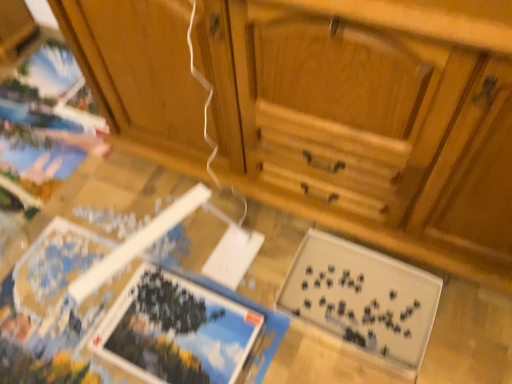
The image size is (512, 384). I want to click on wooden puzzle pieces at lower center, so click(77, 262).

You are a GUI agent. You are given a task and a screenshot of the screen. Output one action in this format:
    pyautogui.click(x=<x>, y=<y>)
    Task: Click on the black matte puzzle pieces at lower right, which is counted as the 1th magazine, starting from the right
    This screenshot has height=384, width=512.
    Given the screenshot: What is the action you would take?
    pyautogui.click(x=362, y=298)

Describe the element at coordinates (176, 331) in the screenshot. I see `blue glossy puzzle piece at lower left, the 1th magazine in the left-to-right sequence` at that location.

Find the location of a particular element. The height and width of the screenshot is (384, 512). blue glossy puzzle piece at lower left, the second magazine from the right is located at coordinates (176, 331).

Image resolution: width=512 pixels, height=384 pixels. In order to click on wooden puzzle pieces at lower center in this screenshot , I will do `click(77, 262)`.

Considering the relative sizes of blue glossy puzzle piece at lower left, the 1th magazine in the left-to-right sequence, and black matte puzzle pieces at lower right, which ranks as the second magazine in left-to-right order, in the image provided, is blue glossy puzzle piece at lower left, the 1th magazine in the left-to-right sequence, smaller than black matte puzzle pieces at lower right, which ranks as the second magazine in left-to-right order,?

Yes, blue glossy puzzle piece at lower left, the 1th magazine in the left-to-right sequence, is smaller than black matte puzzle pieces at lower right, which ranks as the second magazine in left-to-right order.

Considering the positions of point (238, 316) and point (393, 342), is point (238, 316) closer or farther from the camera than point (393, 342)?

Point (238, 316).

Which of these two, blue glossy puzzle piece at lower left, the second magazine from the right, or black matte puzzle pieces at lower right, which ranks as the second magazine in left-to-right order, stands shorter?

blue glossy puzzle piece at lower left, the second magazine from the right.

From the picture: Would you say wooden cabinet at center is part of black matte puzzle pieces at lower right, which ranks as the second magazine in left-to-right order,'s contents?

No.

Is black matte puzzle pieces at lower right, which is counted as the 1th magazine, starting from the right, at the right side of wooden cabinet at center?

Yes.

Between black matte puzzle pieces at lower right, which is counted as the 1th magazine, starting from the right, and wooden cabinet at center, which one has less height?

black matte puzzle pieces at lower right, which is counted as the 1th magazine, starting from the right.

Who is more distant, black matte puzzle pieces at lower right, which ranks as the second magazine in left-to-right order, or wooden cabinet at center?

black matte puzzle pieces at lower right, which ranks as the second magazine in left-to-right order, is further away from the camera.

Is wooden puzzle pieces at lower center in front of or behind black matte puzzle pieces at lower right, which ranks as the second magazine in left-to-right order, in the image?

wooden puzzle pieces at lower center is in front of black matte puzzle pieces at lower right, which ranks as the second magazine in left-to-right order.

Based on the photo, from a real-world perspective, relative to black matte puzzle pieces at lower right, which is counted as the 1th magazine, starting from the right, is wooden puzzle pieces at lower center vertically above or below?

In terms of real-world spatial position, wooden puzzle pieces at lower center is above black matte puzzle pieces at lower right, which is counted as the 1th magazine, starting from the right.

How many degrees apart are the facing directions of wooden puzzle pieces at lower center and black matte puzzle pieces at lower right, which ranks as the second magazine in left-to-right order?

The angle between the facing direction of wooden puzzle pieces at lower center and the facing direction of black matte puzzle pieces at lower right, which ranks as the second magazine in left-to-right order, is 88.6 degrees.

Find the location of a particular element. This screenshot has width=512, height=384. table above the black matte puzzle pieces at lower right, which ranks as the second magazine in left-to-right order (from a real-world perspective) is located at coordinates (77, 262).

Is wooden cabinet at center far from black matte puzzle pieces at lower right, which ranks as the second magazine in left-to-right order?

They are positioned close to each other.

Is wooden cabinet at center positioned with its back to black matte puzzle pieces at lower right, which is counted as the 1th magazine, starting from the right?

No.

Based on the photo, is wooden cabinet at center to the left or to the right of black matte puzzle pieces at lower right, which ranks as the second magazine in left-to-right order, in the image?

wooden cabinet at center is positioned on black matte puzzle pieces at lower right, which ranks as the second magazine in left-to-right order,'s left side.

Does wooden cabinet at center contain black matte puzzle pieces at lower right, which is counted as the 1th magazine, starting from the right?

No, black matte puzzle pieces at lower right, which is counted as the 1th magazine, starting from the right, is not inside wooden cabinet at center.

How distant is blue glossy puzzle piece at lower left, the second magazine from the right, from wooden cabinet at center?

blue glossy puzzle piece at lower left, the second magazine from the right, is 21.72 inches from wooden cabinet at center.

Which object is wider, blue glossy puzzle piece at lower left, the second magazine from the right, or wooden cabinet at center?

wooden cabinet at center.

Does point (225, 313) come farther from viewer compared to point (438, 28)?

Yes, it is behind point (438, 28).

Is blue glossy puzzle piece at lower left, the second magazine from the right, located outside wooden cabinet at center?

Absolutely, blue glossy puzzle piece at lower left, the second magazine from the right, is external to wooden cabinet at center.

Is wooden cabinet at center closer to the viewer compared to wooden puzzle pieces at lower center?

That is True.

Considering the relative sizes of wooden cabinet at center and wooden puzzle pieces at lower center in the image provided, is wooden cabinet at center wider than wooden puzzle pieces at lower center?

No, wooden cabinet at center is not wider than wooden puzzle pieces at lower center.

From a real-world perspective, between wooden cabinet at center and wooden puzzle pieces at lower center, who is vertically higher?

In real-world perspective, wooden cabinet at center is above.

Is wooden puzzle pieces at lower center at the back of wooden cabinet at center?

No, wooden puzzle pieces at lower center is not at the back of wooden cabinet at center.

Would you say wooden puzzle pieces at lower center is to the left or to the right of wooden cabinet at center in the picture?

In the image, wooden puzzle pieces at lower center appears on the left side of wooden cabinet at center.

Would you say wooden puzzle pieces at lower center is outside wooden cabinet at center?

wooden puzzle pieces at lower center is positioned outside wooden cabinet at center.

How much distance is there between wooden puzzle pieces at lower center and wooden cabinet at center?

wooden puzzle pieces at lower center and wooden cabinet at center are 15.92 inches apart.

Is wooden puzzle pieces at lower center oriented towards wooden cabinet at center?

No, wooden puzzle pieces at lower center is not facing towards wooden cabinet at center.

This screenshot has width=512, height=384. Identify the location of magazine lying above the blue glossy puzzle piece at lower left, the 1th magazine in the left-to-right sequence (from the image's perspective). (362, 298).

Which magazine is the 2nd one when counting from the back of the wooden cabinet at center? Please provide its 2D coordinates.

[(362, 298)]

Consider the image. Estimate the real-world distances between objects in this image. Which object is closer to wooden cabinet at center, black matte puzzle pieces at lower right, which ranks as the second magazine in left-to-right order, or wooden puzzle pieces at lower center?

black matte puzzle pieces at lower right, which ranks as the second magazine in left-to-right order, lies closer to wooden cabinet at center than the other object.

Looking at the image, which one is located closer to black matte puzzle pieces at lower right, which ranks as the second magazine in left-to-right order, wooden cabinet at center or wooden puzzle pieces at lower center?

The object closer to black matte puzzle pieces at lower right, which ranks as the second magazine in left-to-right order, is wooden puzzle pieces at lower center.

Based on their spatial positions, is blue glossy puzzle piece at lower left, the 1th magazine in the left-to-right sequence, or wooden cabinet at center closer to wooden puzzle pieces at lower center?

blue glossy puzzle piece at lower left, the 1th magazine in the left-to-right sequence, is closer to wooden puzzle pieces at lower center.

Considering their positions, is wooden puzzle pieces at lower center positioned closer to black matte puzzle pieces at lower right, which ranks as the second magazine in left-to-right order, than wooden cabinet at center?

wooden puzzle pieces at lower center lies closer to black matte puzzle pieces at lower right, which ranks as the second magazine in left-to-right order, than the other object.

Which object lies nearer to the anchor point blue glossy puzzle piece at lower left, the 1th magazine in the left-to-right sequence, wooden puzzle pieces at lower center or black matte puzzle pieces at lower right, which ranks as the second magazine in left-to-right order?

wooden puzzle pieces at lower center.

When comparing their distances from black matte puzzle pieces at lower right, which is counted as the 1th magazine, starting from the right, does blue glossy puzzle piece at lower left, the 1th magazine in the left-to-right sequence, or wooden cabinet at center seem closer?

blue glossy puzzle piece at lower left, the 1th magazine in the left-to-right sequence.

Considering their positions, is wooden cabinet at center positioned further to wooden puzzle pieces at lower center than blue glossy puzzle piece at lower left, the second magazine from the right?

wooden cabinet at center is further to wooden puzzle pieces at lower center.

In the scene shown: From the image, which object appears to be nearer to black matte puzzle pieces at lower right, which is counted as the 1th magazine, starting from the right, wooden puzzle pieces at lower center or blue glossy puzzle piece at lower left, the second magazine from the right?

wooden puzzle pieces at lower center.

The width and height of the screenshot is (512, 384). What are the coordinates of `cabinetry between wooden puzzle pieces at lower center and black matte puzzle pieces at lower right, which ranks as the second magazine in left-to-right order, in the horizontal direction` in the screenshot? It's located at (371, 119).

Identify the location of magazine between wooden puzzle pieces at lower center and black matte puzzle pieces at lower right, which is counted as the 1th magazine, starting from the right. (176, 331).

At what (x,y) coordinates should I click in order to perform the action: click on table between wooden cabinet at center and blue glossy puzzle piece at lower left, the second magazine from the right, in the up-down direction. Please return your answer as a coordinate pair (x, y). The height and width of the screenshot is (384, 512). Looking at the image, I should click on (77, 262).

Where is `magazine between wooden cabinet at center and blue glossy puzzle piece at lower left, the 1th magazine in the left-to-right sequence, in the vertical direction`? Image resolution: width=512 pixels, height=384 pixels. magazine between wooden cabinet at center and blue glossy puzzle piece at lower left, the 1th magazine in the left-to-right sequence, in the vertical direction is located at coordinates (362, 298).